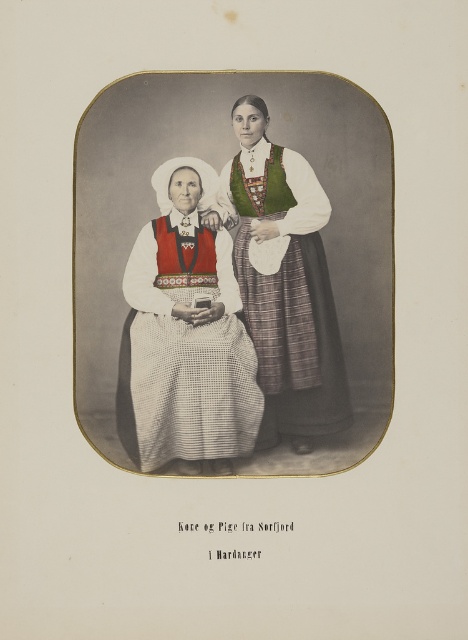
Image resolution: width=468 pixels, height=640 pixels. Describe the element at coordinates (184, 333) in the screenshot. I see `knitted fabric dress at left` at that location.

Can you confirm if knitted fabric dress at left is positioned to the right of green woven blouse at center?

No, knitted fabric dress at left is not to the right of green woven blouse at center.

What do you see at coordinates (184, 333) in the screenshot?
I see `knitted fabric dress at left` at bounding box center [184, 333].

At what (x,y) coordinates should I click in order to perform the action: click on knitted fabric dress at left. Please return your answer as a coordinate pair (x, y). This screenshot has height=640, width=468. Looking at the image, I should click on (184, 333).